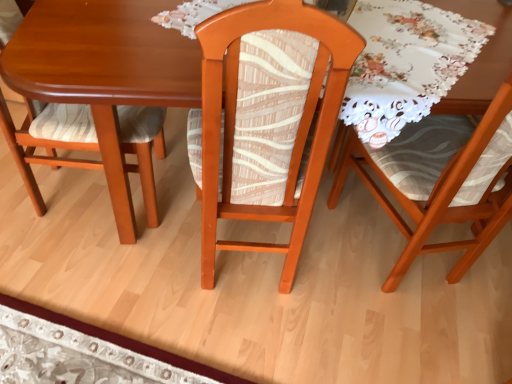
Find the location of a particular element. This screenshot has width=512, height=384. free space below wooden chair at right, positioned as the 1th chair in right-to-left order (from a real-world perspective) is located at coordinates (389, 246).